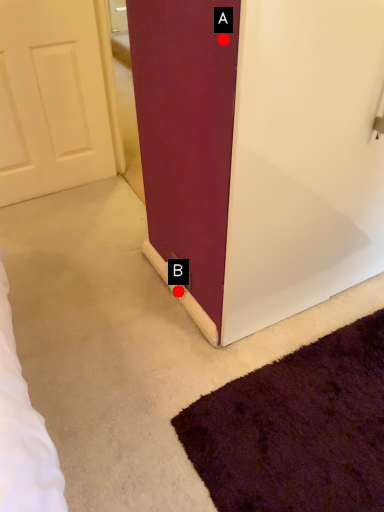
Question: Two points are circled on the image, labeled by A and B beside each circle. Which point is closer to the camera?

Choices:
 (A) A is closer
 (B) B is closer

Answer: (A)